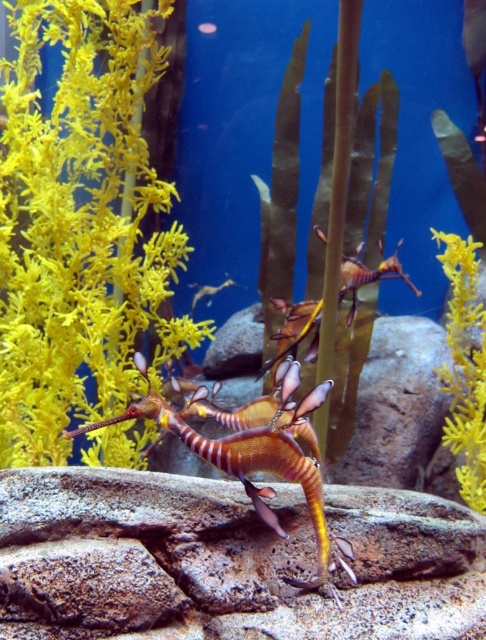
Question: Can you confirm if yellow matte plant at left is positioned above shiny metallic fish at center?

Choices:
 (A) yes
 (B) no

Answer: (A)

Question: Which of the following is the farthest from the observer?

Choices:
 (A) (448, 262)
 (B) (17, 13)

Answer: (B)

Question: Which point is farther to the camera?

Choices:
 (A) shiny metallic seahorse at center
 (B) translucent yellow fish at center

Answer: (B)

Question: Can you confirm if yellow matte plant at left is smaller than yellow matte plant at right?

Choices:
 (A) no
 (B) yes

Answer: (A)

Question: Where is yellow matte plant at left located in relation to translucent yellow fish at center in the image?

Choices:
 (A) right
 (B) left

Answer: (B)

Question: Estimate the real-world distances between objects in this image. Which object is farther from the smooth gray rock at center?

Choices:
 (A) yellow matte plant at left
 (B) shiny metallic seahorse at center
 (C) yellow matte plant at right
 (D) translucent yellow fish at center

Answer: (D)